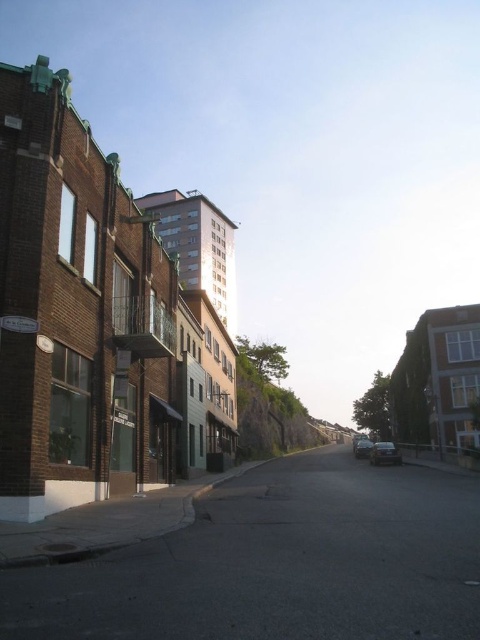
Question: Estimate the real-world distances between objects in this image. Which object is closer to the shiny silver car at center?

Choices:
 (A) dark asphalt road at center
 (B) shiny silver sedan at center

Answer: (B)

Question: Is dark asphalt road at center below shiny silver car at center?

Choices:
 (A) yes
 (B) no

Answer: (B)

Question: Does shiny black sedan at center appear on the right side of shiny silver sedan at center?

Choices:
 (A) yes
 (B) no

Answer: (A)

Question: Which point appears farthest from the camera in this image?

Choices:
 (A) (357, 444)
 (B) (369, 440)

Answer: (B)

Question: Among these objects, which one is nearest to the camera?

Choices:
 (A) shiny black sedan at center
 (B) shiny silver sedan at center
 (C) shiny silver car at center

Answer: (A)

Question: Is shiny black sedan at center further to the viewer compared to shiny silver car at center?

Choices:
 (A) no
 (B) yes

Answer: (A)